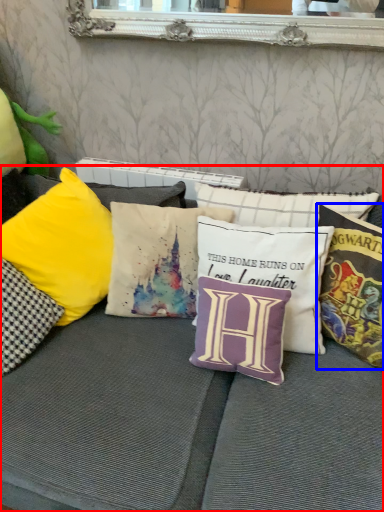
Question: Which object appears closest to the camera in this image, studio couch (highlighted by a red box) or pillow (highlighted by a blue box)?

Choices:
 (A) studio couch
 (B) pillow

Answer: (A)